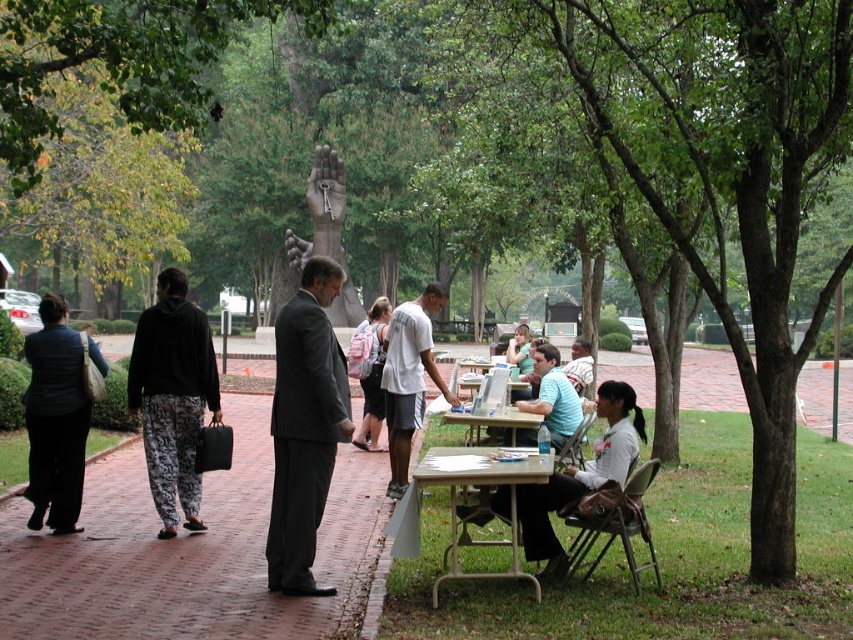
Question: Based on their relative distances, which object is nearer to the dark gray suit at center?

Choices:
 (A) light gray fabric shirt at lower center
 (B) light brown leather jacket at lower right
 (C) dark blue denim jacket at left

Answer: (A)

Question: Which point appears closest to the camera in this image?

Choices:
 (A) (543, 394)
 (B) (587, 356)
 (C) (383, 396)

Answer: (A)

Question: Is black cotton hoodie at left below light gray fabric shirt at lower center?

Choices:
 (A) no
 (B) yes

Answer: (A)

Question: Estimate the real-world distances between objects in this image. Which object is farther from the light brown leather jacket at lower right?

Choices:
 (A) white matte shirt at center
 (B) light pink backpack at center
 (C) wooden table at center

Answer: (B)

Question: Is dark gray suit at center wider than metallic silver table at lower center?

Choices:
 (A) no
 (B) yes

Answer: (A)

Question: Is black cotton hoodie at left to the left of metallic silver table at lower center from the viewer's perspective?

Choices:
 (A) no
 (B) yes

Answer: (B)